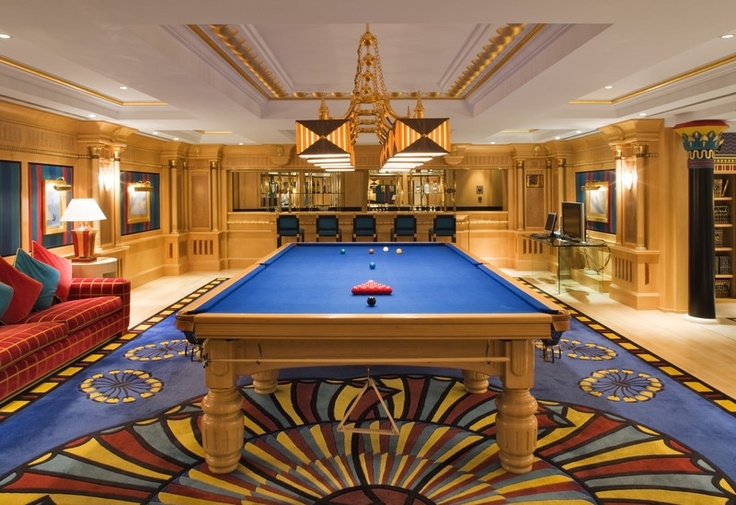
In order to click on bar in this screenshot , I will do `click(349, 218)`.